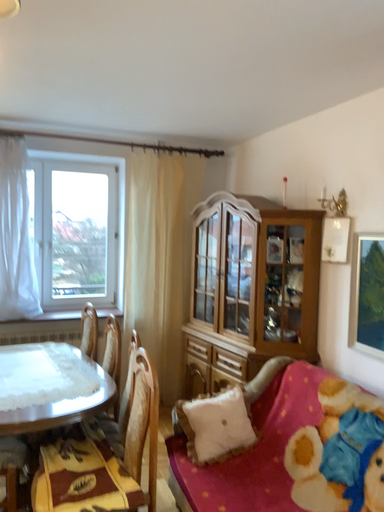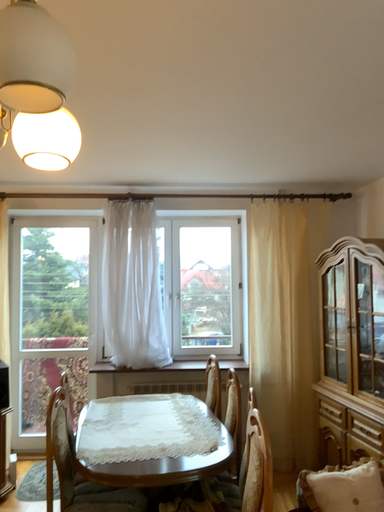
Question: How did the camera likely rotate when shooting the video?

Choices:
 (A) rotated upward
 (B) rotated downward

Answer: (A)